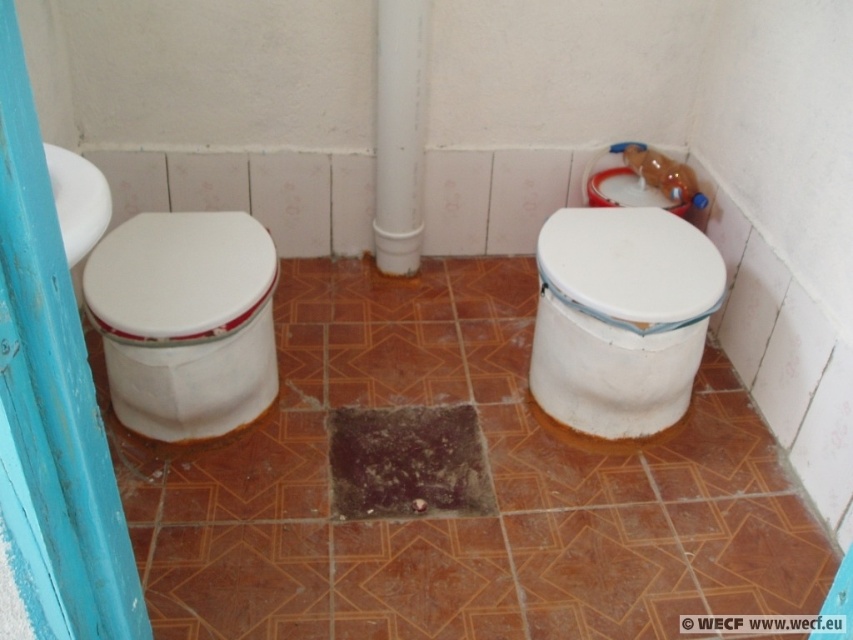
Question: Which object appears closest to the camera in this image?

Choices:
 (A) blue painted wood door at left
 (B) white glossy toilet lid at left
 (C) white plastic pipe at center
 (D) white glossy toilet at right

Answer: (A)

Question: Which point is closer to the camera?

Choices:
 (A) white glossy toilet at right
 (B) translucent plastic bottle at upper right

Answer: (A)

Question: In this image, where is blue painted wood door at left located relative to translucent plastic bottle at upper right?

Choices:
 (A) left
 (B) right

Answer: (A)

Question: Can you confirm if white glossy toilet lid at right is wider than white plastic pipe at center?

Choices:
 (A) yes
 (B) no

Answer: (A)

Question: Among these objects, which one is farthest from the camera?

Choices:
 (A) white glossy toilet at right
 (B) white glossy toilet lid at left
 (C) brown tile at center
 (D) blue painted wood door at left

Answer: (A)

Question: Can you confirm if white glossy toilet at right is wider than white glossy toilet lid at right?

Choices:
 (A) no
 (B) yes

Answer: (A)